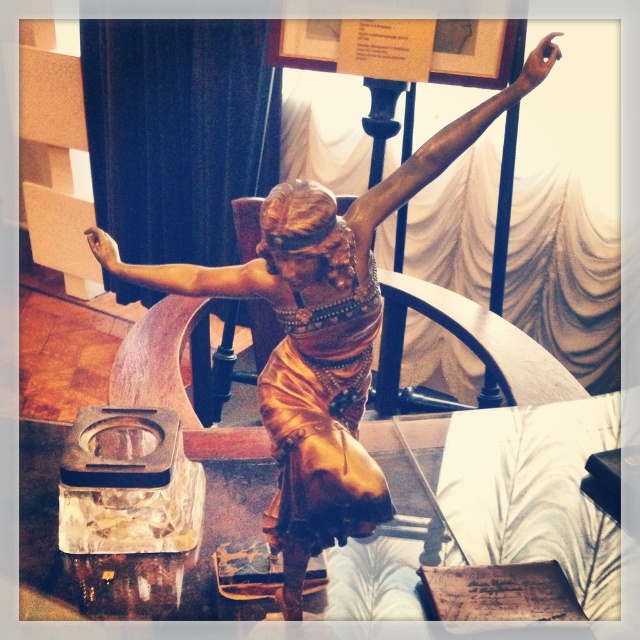
Which is more to the left, bronze arm at upper center or bronze statue arm at center?

From the viewer's perspective, bronze statue arm at center appears more on the left side.

Who is shorter, bronze arm at upper center or bronze statue arm at center?

bronze statue arm at center is shorter.

Which is behind, point (417, 150) or point (237, 276)?

Point (237, 276)

Identify the location of bronze arm at upper center. The image size is (640, 640). (445, 147).

Is gold shiny statue at center to the left of bronze statue arm at center from the viewer's perspective?

In fact, gold shiny statue at center is to the right of bronze statue arm at center.

Where is `gold shiny statue at center`? The image size is (640, 640). gold shiny statue at center is located at coordinates (339, 340).

Measure the distance between point (352,244) and camera.

Point (352,244) is 4.29 feet away from camera.

This screenshot has width=640, height=640. Identify the location of gold shiny statue at center. (339, 340).

Can you confirm if gold shiny statue at center is shorter than bronze arm at upper center?

No.

Does point (280, 308) lie in front of point (360, 224)?

No, it is behind (360, 224).

Who is more forward, (x=380, y=202) or (x=397, y=198)?

Point (x=380, y=202)

Where is `gold shiny statue at center`? gold shiny statue at center is located at coordinates (339, 340).